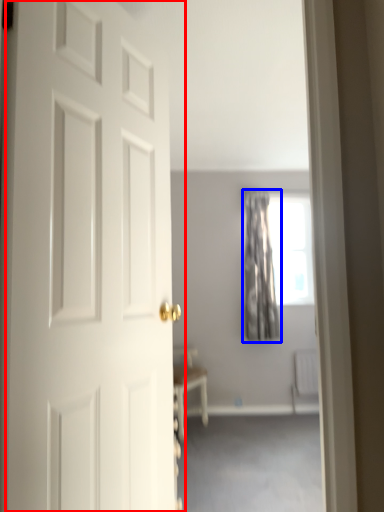
Question: Which object appears closest to the camera in this image, door (highlighted by a red box) or curtain (highlighted by a blue box)?

Choices:
 (A) door
 (B) curtain

Answer: (A)